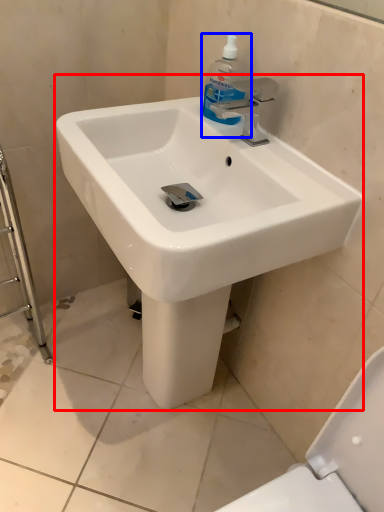
Question: Which point is closer to the camera, sink (highlighted by a red box) or cleaning product (highlighted by a blue box)?

Choices:
 (A) sink
 (B) cleaning product

Answer: (A)